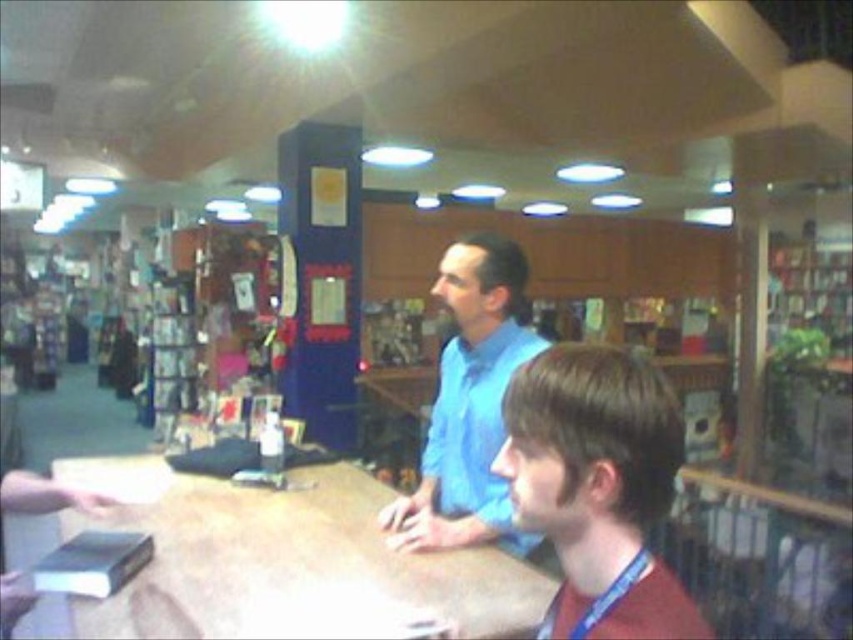
From the picture: You are a customer standing at the entrance of the bookstore and want to approach the wooden table at center and the brown matte hair at center. Which one is closer to you?

The wooden table at center is closer to you because it is further to the viewer than the brown matte hair at center, meaning it occupies a more forward position in the scene.

You are a delivery person who needs to place a large package on the wooden table at center. The package is as wide as the blue cotton shirt at center. Will the package fit on the table?

The wooden table at center might be wider than blue cotton shirt at center, so there is a possibility that the package will fit, but it is uncertain. Check the exact dimensions before placing the package.

You are a customer standing at the entrance of the bookstore. You see the wooden table at center and the blue cotton shirt at center. Which object is closer to the entrance?

The wooden table at center is closer to the entrance because it is located below the blue cotton shirt at center, indicating it is positioned lower and thus nearer to the entrance.